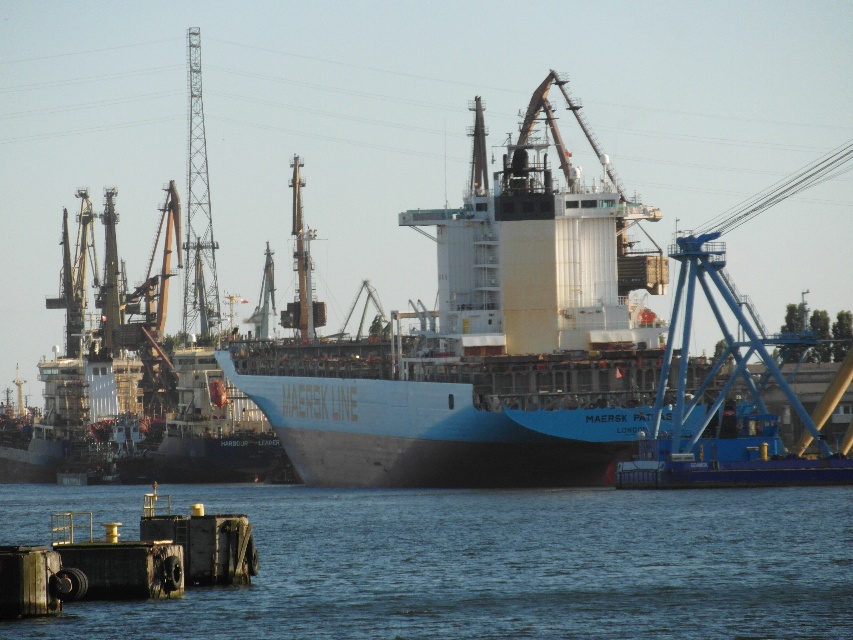
Does blue water at lower left appear over white matte cargo ship at center?

No, blue water at lower left is not above white matte cargo ship at center.

Between blue water at lower left and white matte cargo ship at center, which one has more height?

Standing taller between the two is white matte cargo ship at center.

Who is more forward, (477, 577) or (607, 330)?

Positioned in front is point (477, 577).

Find the location of a particular element. The height and width of the screenshot is (640, 853). blue water at lower left is located at coordinates (508, 564).